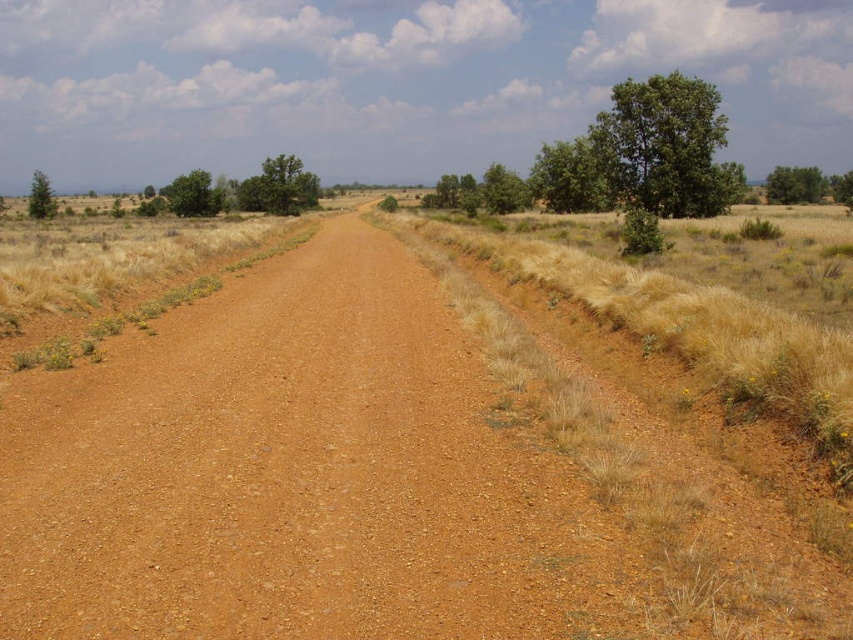
Between green leafy tree at center and green leafy tree at upper right, which one appears on the right side from the viewer's perspective?

Positioned to the right is green leafy tree at upper right.

Where is `green leafy tree at center`? green leafy tree at center is located at coordinates (277, 188).

What do you see at coordinates (277, 188) in the screenshot? I see `green leafy tree at center` at bounding box center [277, 188].

Identify the location of green leafy tree at center. This screenshot has height=640, width=853. tap(277, 188).

Between brown gravel dirt track at center and green leafy tree at upper right, which one has less height?

brown gravel dirt track at center is shorter.

Looking at this image, can you confirm if brown gravel dirt track at center is smaller than green leafy tree at upper right?

Yes, brown gravel dirt track at center is smaller than green leafy tree at upper right.

Is point (358, 308) behind point (816, 189)?

No, (358, 308) is in front of (816, 189).

Locate an element on the screen. brown gravel dirt track at center is located at coordinates (286, 472).

Between green leafy tree at upper left and green matte tree at left, which one has more height?

With more height is green matte tree at left.

Can you confirm if green leafy tree at upper left is smaller than green matte tree at left?

Yes, green leafy tree at upper left is smaller than green matte tree at left.

Identify the location of green leafy tree at upper left. The image size is (853, 640). (193, 195).

Find the location of a particular element. green leafy tree at upper left is located at coordinates (193, 195).